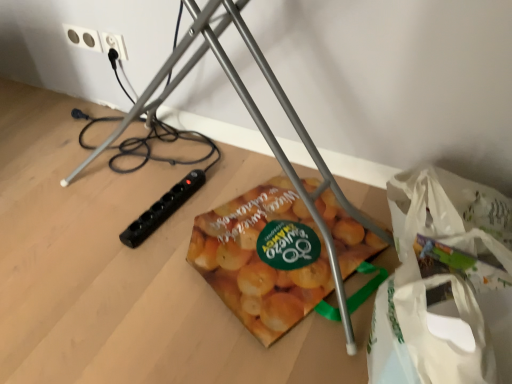
The width and height of the screenshot is (512, 384). In order to click on empty space that is ontop of metallic tripod at center (from a real-world perspective) in this screenshot , I will do `click(124, 219)`.